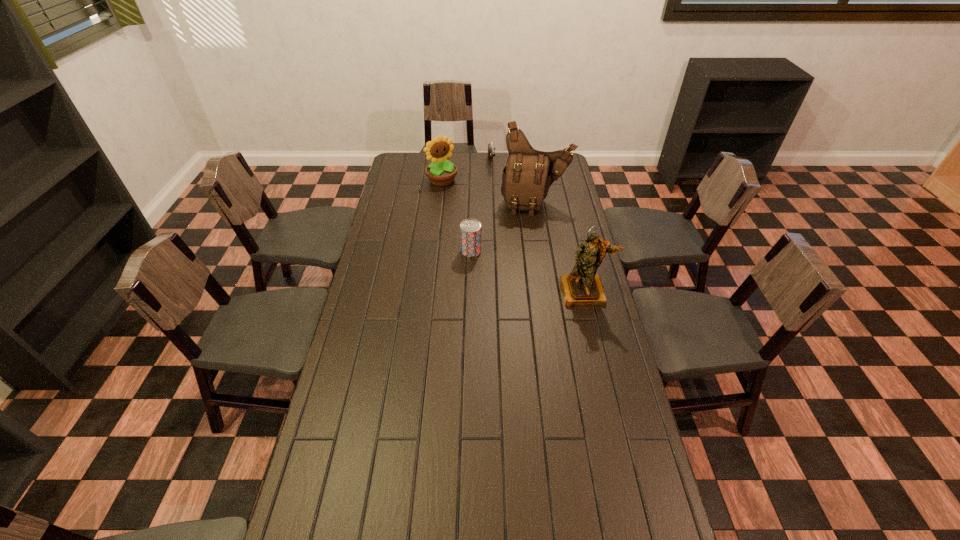
Identify the location of free space located 0.310m on the front-facing side of the fourth shortest object. The image size is (960, 540). (606, 382).

Find the location of a particular element. Image resolution: width=960 pixels, height=540 pixels. free space located at the barrel of the third object from right to left is located at coordinates (501, 219).

Find the location of a particular element. The height and width of the screenshot is (540, 960). free spot located at the barrel of the third object from right to left is located at coordinates (495, 188).

The width and height of the screenshot is (960, 540). In order to click on free space located at the barrel of the third object from right to left in this screenshot , I will do `click(499, 206)`.

Locate an element on the screen. vacant space located 0.370m on the face of the third tallest object is located at coordinates (482, 230).

The image size is (960, 540). What are the coordinates of `vacant space located 0.260m on the face of the third tallest object` in the screenshot? It's located at (470, 217).

Image resolution: width=960 pixels, height=540 pixels. What are the coordinates of `vacant space positioned on the face of the third tallest object` in the screenshot? It's located at (478, 225).

The image size is (960, 540). Identify the location of vacant region located 0.060m on the front-facing side of the third nearest object. (535, 225).

Image resolution: width=960 pixels, height=540 pixels. What are the coordinates of `vacant space located on the front-facing side of the third nearest object` in the screenshot? It's located at (535, 253).

Locate an element on the screen. free space located 0.070m on the front-facing side of the third nearest object is located at coordinates click(x=535, y=226).